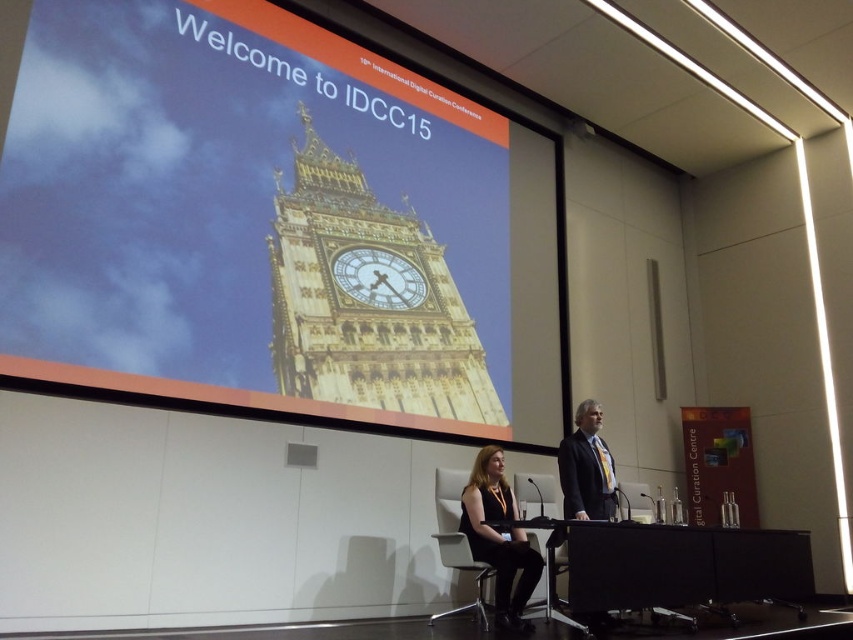
You are a stagehand who needs to place a 2.5 meter wide banner between the gold metallic clock tower at upper center and the podium. Will there be enough space?

The distance between the gold metallic clock tower at upper center and the podium is 3.76 meters. Since the banner is 2.5 meters wide, there is enough space to place it between them.